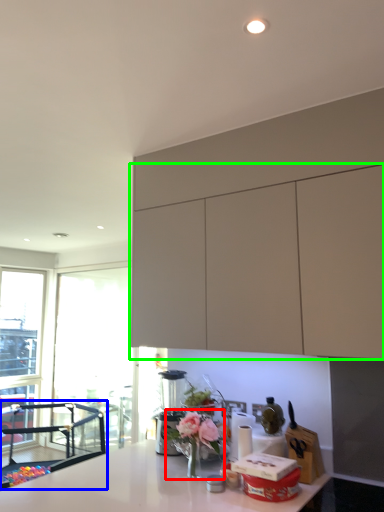
Question: Which object is positioned closest to floral arrangement (highlighted by a red box)? Select from chair (highlighted by a blue box) and cabinetry (highlighted by a green box).

Choices:
 (A) chair
 (B) cabinetry

Answer: (B)